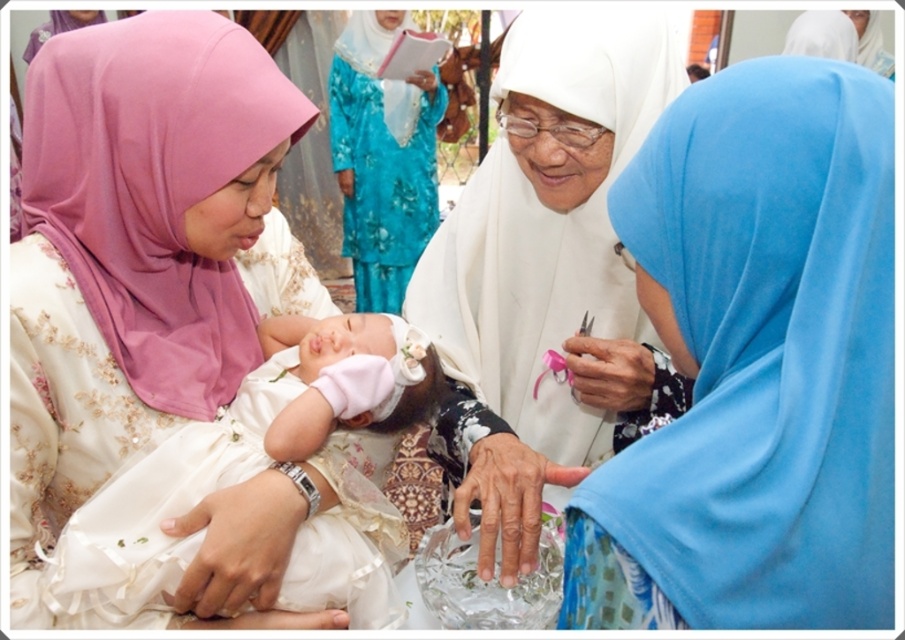
You are observing a cultural ceremony and notice a white satin hijab at center and a dry skin hand at center. Which object is positioned higher in the scene?

The white satin hijab at center is located above the dry skin hand at center, so it is positioned higher.